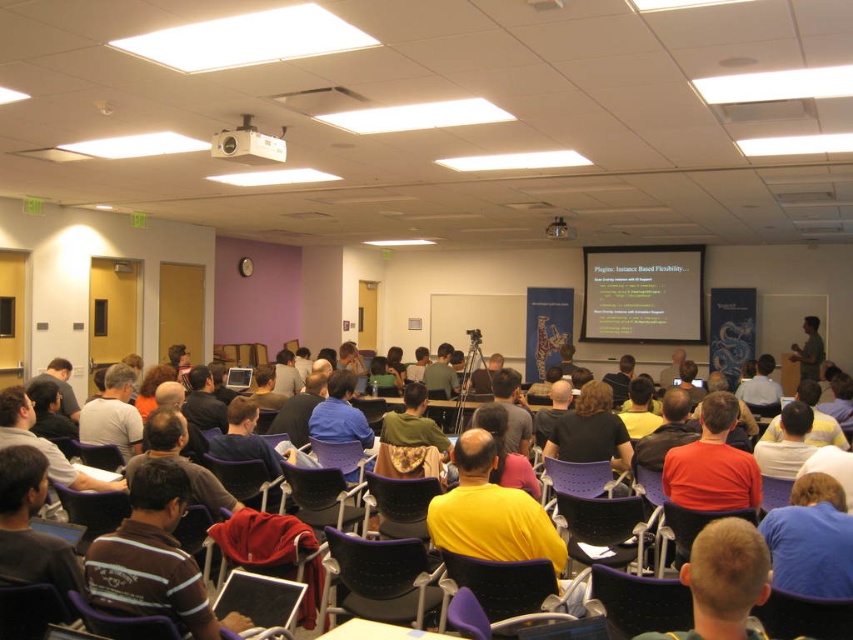
Is striped cotton shirt at lower left taller than matte orange shirt at center?

In fact, striped cotton shirt at lower left may be shorter than matte orange shirt at center.

Who is positioned more to the right, striped cotton shirt at lower left or matte orange shirt at center?

matte orange shirt at center

This screenshot has width=853, height=640. I want to click on striped cotton shirt at lower left, so click(x=154, y=557).

Who is taller, striped cotton shirt at lower left or dark gray shirt at center?

With more height is dark gray shirt at center.

Does striped cotton shirt at lower left have a smaller size compared to dark gray shirt at center?

Correct, striped cotton shirt at lower left occupies less space than dark gray shirt at center.

Where is `striped cotton shirt at lower left`? Image resolution: width=853 pixels, height=640 pixels. striped cotton shirt at lower left is located at coordinates (154, 557).

Find the location of `striped cotton shirt at lower left`. striped cotton shirt at lower left is located at coordinates (154, 557).

Can you confirm if matte orange shirt at center is bigger than dark gray shirt at center?

No.

Does matte orange shirt at center have a smaller size compared to dark gray shirt at center?

Correct, matte orange shirt at center occupies less space than dark gray shirt at center.

Locate an element on the screen. This screenshot has height=640, width=853. matte orange shirt at center is located at coordinates (712, 464).